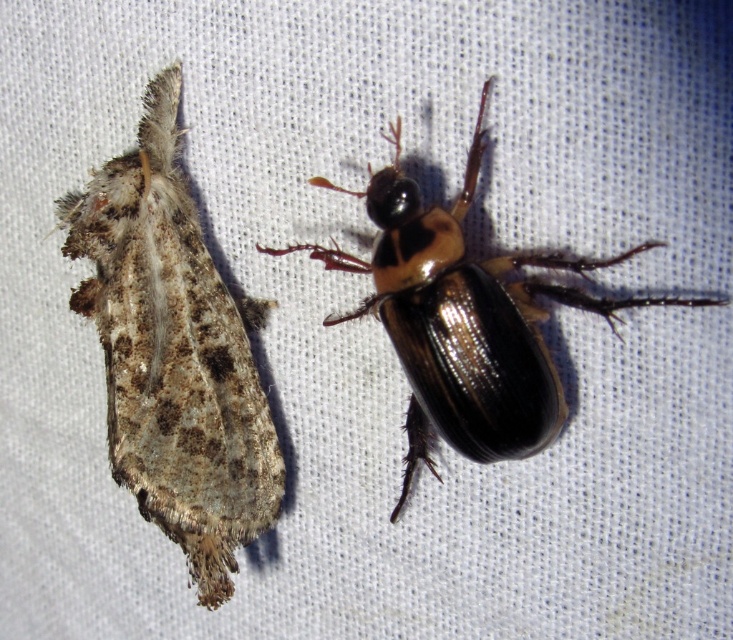
You are a child who wants to gently move the shiny black beetle at center closer to the fuzzy brown moth at left. If the beetle can move 3 inches per minute, how many minutes will it take for the beetle to reach the moth?

The distance between the fuzzy brown moth at left and the shiny black beetle at center is 10.87 inches. Since the beetle moves at 3 inches per minute, it will take approximately 3.62 minutes to reach the moth.

You are an entomologist examining the image. You notice a point at coordinates (x=174, y=353). Which insect does this point correspond to?

The point at coordinates (x=174, y=353) corresponds to the fuzzy brown moth at left.